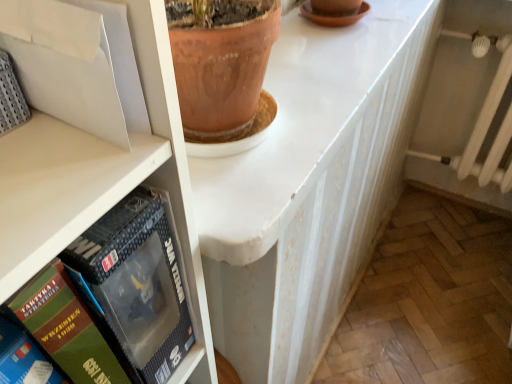
Question: In terms of height, does matte black box at left, the first book viewed from the right, look taller or shorter compared to green cardboard book at lower left, the 1th book from the left?

Choices:
 (A) tall
 (B) short

Answer: (A)

Question: In terms of size, does matte black box at left, which is the 3th book in left-to-right order, appear bigger or smaller than green cardboard book at lower left, the 1th book from the left?

Choices:
 (A) small
 (B) big

Answer: (B)

Question: Estimate the real-world distances between objects in this image. Which object is farther from the white glossy counter top at center?

Choices:
 (A) matte black box at left, the first book viewed from the right
 (B) green cardboard book at lower left, the 1th book from the left
 (C) green matte book at left, the second book when ordered from right to left

Answer: (B)

Question: Which object is positioned farthest from the green cardboard book at lower left, the 1th book from the left?

Choices:
 (A) green matte book at left, arranged as the 2th book when viewed from the left
 (B) white glossy counter top at center
 (C) matte black box at left, the first book viewed from the right

Answer: (B)